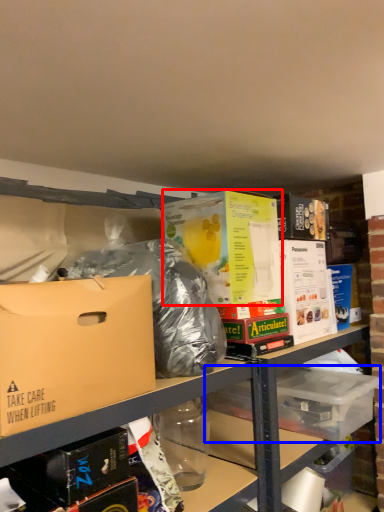
Question: Which point is closer to the camera, box (highlighted by a red box) or storage box (highlighted by a blue box)?

Choices:
 (A) box
 (B) storage box

Answer: (A)